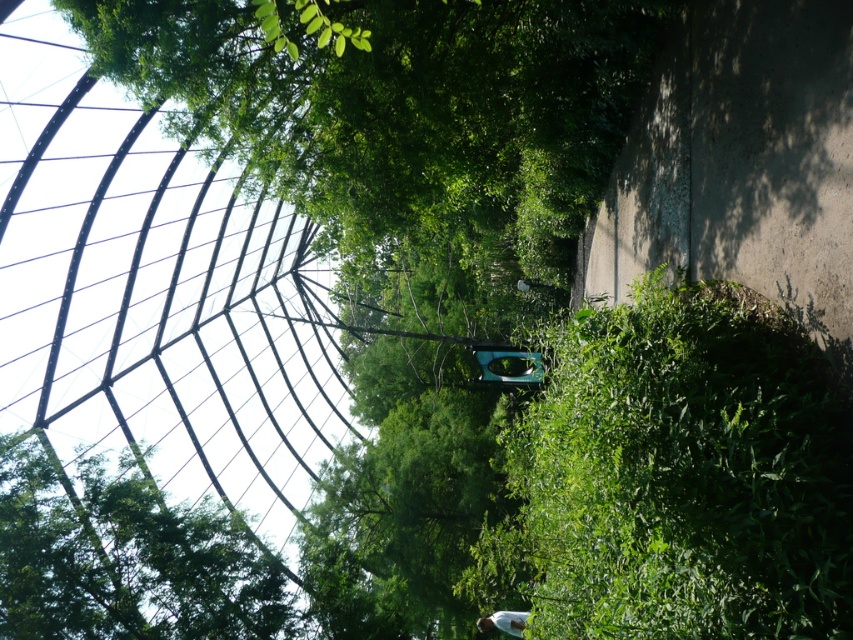
You are a landscape architect designing a new garden layout. You need to place a small bench between the green leafy tree at upper center and the green leafy tree at upper left. Which tree should the bench be closer to if you want it to be proportionally aligned with their widths?

The bench should be closer to the green leafy tree at upper left because the green leafy tree at upper center is wider, so placing the bench closer to the narrower tree would create a balanced proportion between the two trees.

You are a photographer standing at the lower center of the image, wearing a white matte shirt. You want to take a photo of the green leafy tree at upper center. Will the white matte shirt at lower center block your view of the tree?

The green leafy tree at upper center is in front of the white matte shirt at lower center, so the shirt will not block your view of the tree.